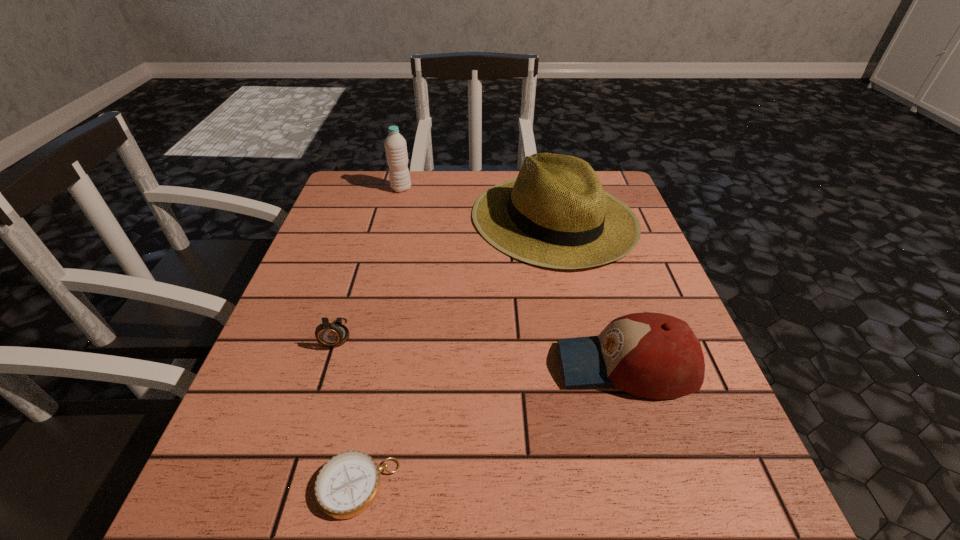
At what (x,y) coordinates should I click in order to perform the action: click on the tallest object. Please return your answer as a coordinate pair (x, y). Looking at the image, I should click on (395, 145).

Where is `sunhat`? The height and width of the screenshot is (540, 960). sunhat is located at coordinates (556, 214).

Identify the location of baseball cap. Image resolution: width=960 pixels, height=540 pixels. (652, 355).

This screenshot has width=960, height=540. What are the coordinates of `the farther compass` in the screenshot? It's located at (332, 335).

Where is `the left compass`? This screenshot has width=960, height=540. the left compass is located at coordinates (332, 335).

The height and width of the screenshot is (540, 960). What are the coordinates of `the nearer compass` in the screenshot? It's located at (347, 485).

Find the location of a particular element. the shortest object is located at coordinates (347, 485).

Identify the location of free region located on the right of the tallest object. The height and width of the screenshot is (540, 960). (488, 188).

Locate an element on the screen. The image size is (960, 540). vacant space situated on the front of the second tallest object is located at coordinates [569, 289].

The width and height of the screenshot is (960, 540). Find the location of `free space located 0.160m on the front-facing side of the baseball cap`. free space located 0.160m on the front-facing side of the baseball cap is located at coordinates tap(467, 366).